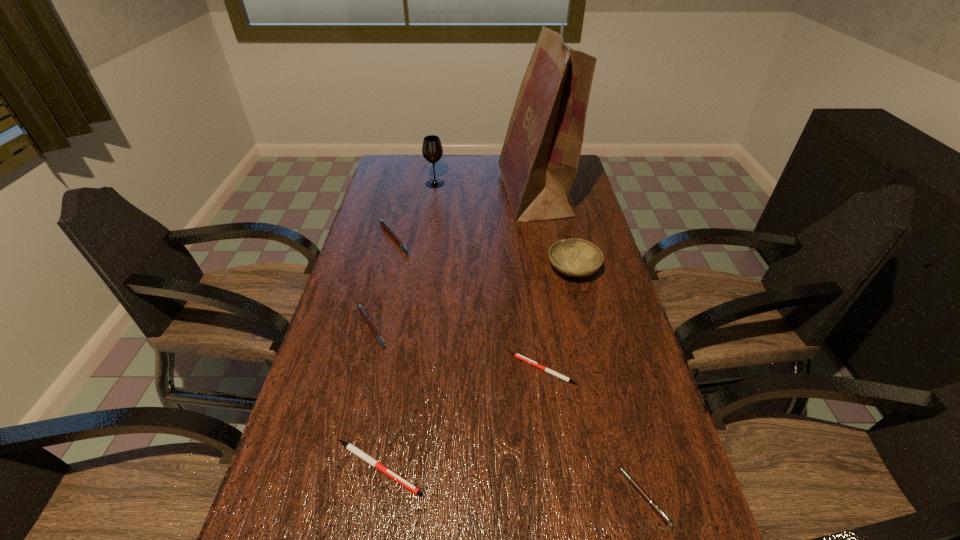
The width and height of the screenshot is (960, 540). I want to click on the tallest object, so click(539, 161).

Identify the location of the seventh shortest object. (432, 150).

Locate an element on the screen. This screenshot has height=540, width=960. wineglass is located at coordinates (432, 150).

The width and height of the screenshot is (960, 540). I want to click on gray bowl, so click(x=575, y=257).

You are a GUI agent. You are given a task and a screenshot of the screen. Output one action in this format:
    pyautogui.click(x=<x>, y=<y>)
    Task: Click on the bowl
    
    Given the screenshot: What is the action you would take?
    pyautogui.click(x=575, y=257)

I want to click on the fifth shortest object, so click(387, 228).

Where is `the tallest pen`? The height and width of the screenshot is (540, 960). the tallest pen is located at coordinates (387, 228).

I want to click on the second smallest pink pen, so click(364, 314).

I want to click on the second nearest pink pen, so point(364,314).

I want to click on the nearer white pen, so click(349, 446).